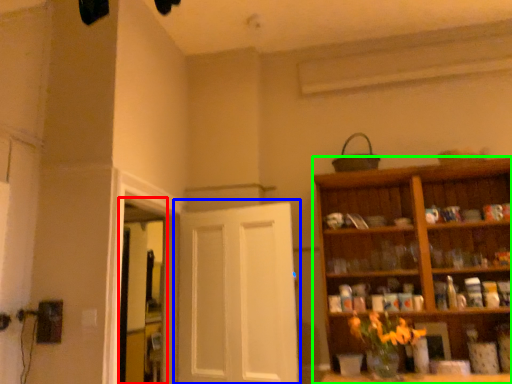
Question: Estimate the real-world distances between objects in this image. Which object is farther from window (highlighted by a red box), door (highlighted by a blue box) or cabinetry (highlighted by a green box)?

Choices:
 (A) door
 (B) cabinetry

Answer: (B)